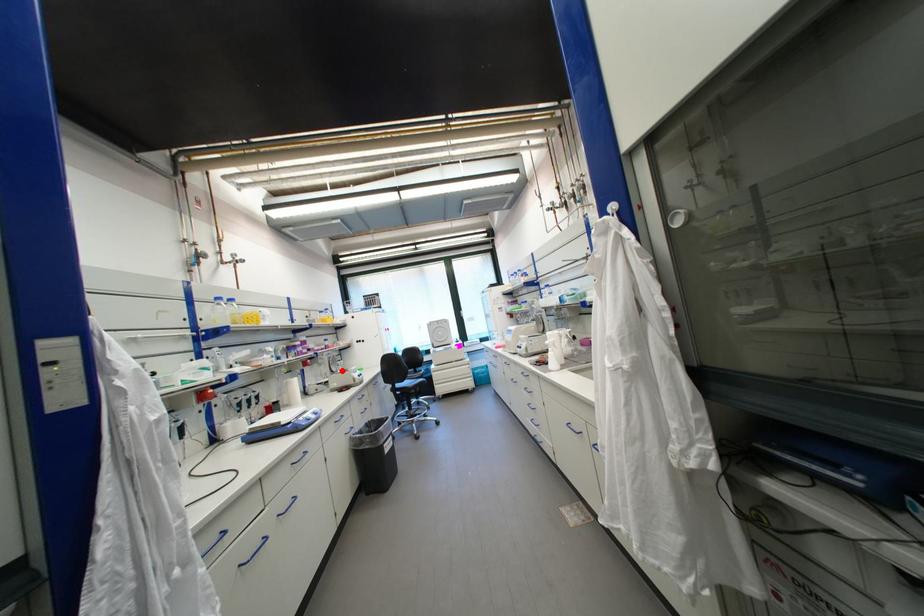
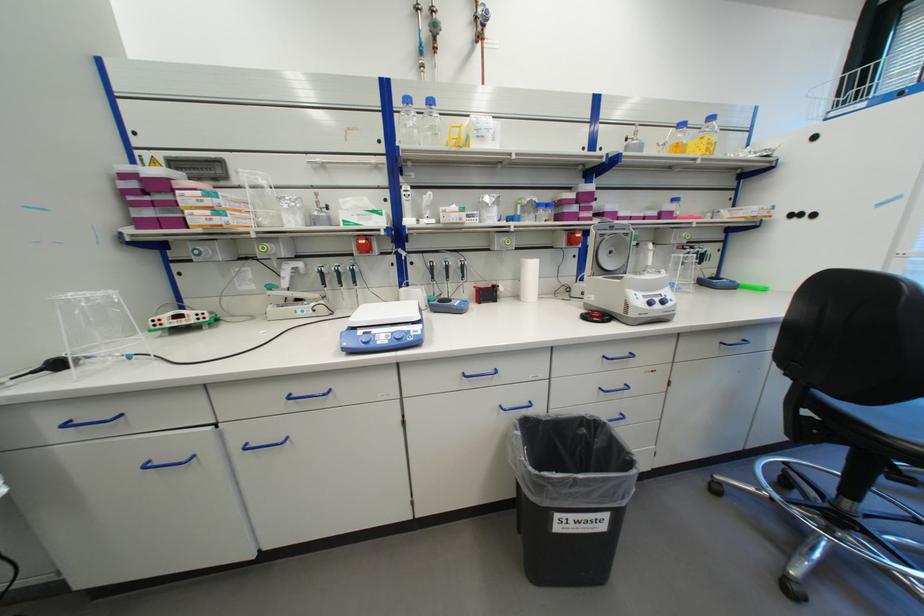
In the second image, find the point that corresponds to the highlighted location in the first image.

(616, 267)